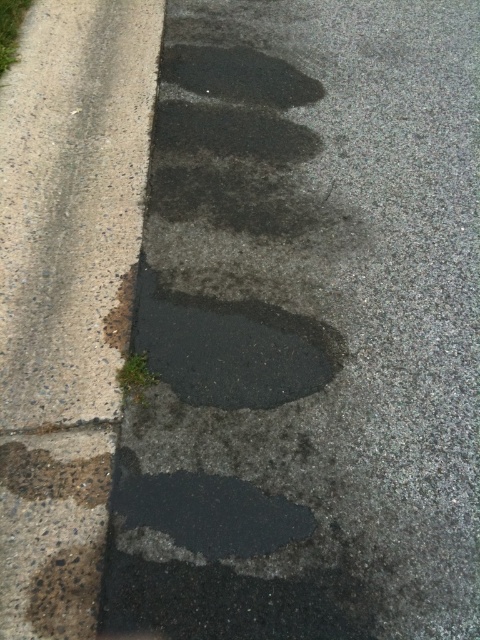
You are a construction worker inspecting a damaged pavement. You notice the dark gray concrete at lower left and the dark gray asphalt crack at lower left. Which of these two is positioned lower in the image?

The dark gray concrete at lower left is located below the dark gray asphalt crack at lower left, so it is positioned lower in the image.

You are a construction worker examining the pavement. You notice the dark gray concrete at lower left and the dark gray asphalt crack at lower left. Which one is located to the right of the other?

The dark gray concrete at lower left is positioned on the right side of dark gray asphalt crack at lower left, so the dark gray concrete at lower left is to the right of the dark gray asphalt crack at lower left.

From the picture: You are a construction worker inspecting the pavement. You notice a black rubber footprint at center and a dark gray concrete at lower left. Which object is elevated more from the ground?

The black rubber footprint at center has a greater height compared to the dark gray concrete at lower left, so the black rubber footprint at center is elevated more from the ground.